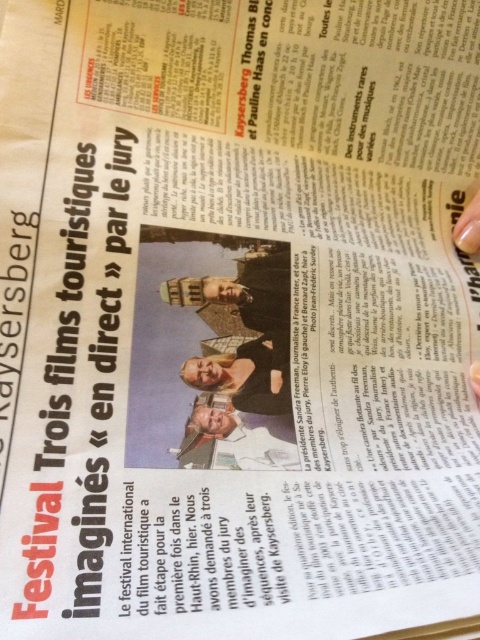
Question: Is matte white face at center thinner than smooth beige suit at center?

Choices:
 (A) no
 (B) yes

Answer: (B)

Question: Estimate the real-world distances between objects in this image. Which object is farther from the smooth beige suit at center?

Choices:
 (A) matte brown statue at center
 (B) matte white face at center
 (C) nail polish at upper right

Answer: (C)

Question: Which object is the farthest from the matte brown statue at center?

Choices:
 (A) matte white face at center
 (B) smooth beige suit at center
 (C) nail polish at upper right

Answer: (C)

Question: Which of these objects is positioned closest to the nail polish at upper right?

Choices:
 (A) matte white face at center
 (B) matte brown statue at center

Answer: (B)

Question: Does matte brown statue at center have a larger size compared to nail polish at upper right?

Choices:
 (A) no
 (B) yes

Answer: (B)

Question: Is matte white face at center wider than smooth beige suit at center?

Choices:
 (A) yes
 (B) no

Answer: (B)